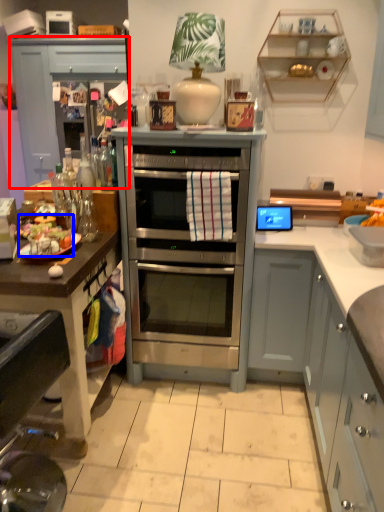
Question: Which object is further to the camera taking this photo, cabinetry (highlighted by a red box) or food (highlighted by a blue box)?

Choices:
 (A) cabinetry
 (B) food

Answer: (A)